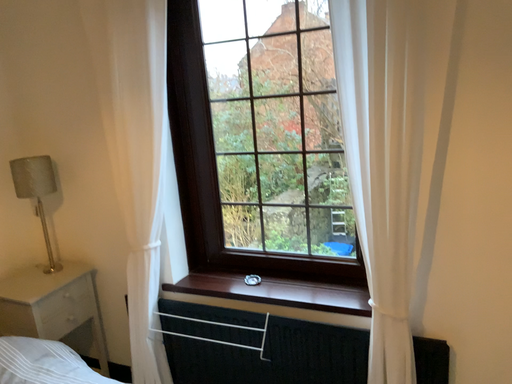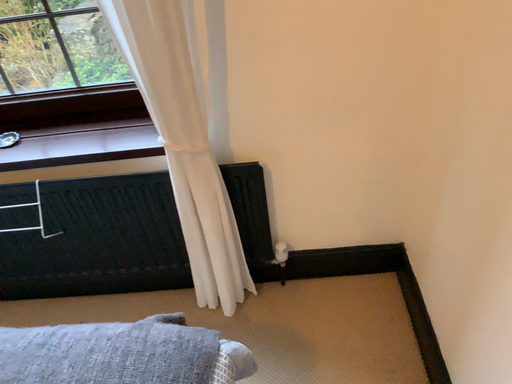
Question: Which way did the camera rotate in the video?

Choices:
 (A) rotated downward
 (B) rotated upward

Answer: (A)